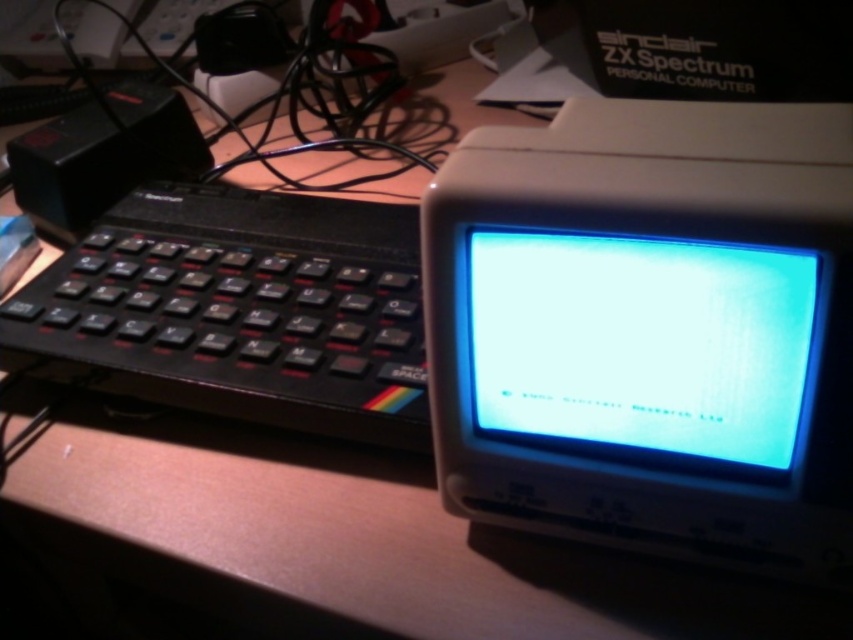
Question: Is black plastic keyboard at left bigger than matte plastic monitor at center?

Choices:
 (A) no
 (B) yes

Answer: (B)

Question: Which of the following is the closest to the observer?

Choices:
 (A) black plastic keyboard at left
 (B) matte plastic monitor at center

Answer: (B)

Question: Is black plastic keyboard at left positioned behind matte plastic monitor at center?

Choices:
 (A) yes
 (B) no

Answer: (A)

Question: Estimate the real-world distances between objects in this image. Which object is farther from the black plastic keyboard at left?

Choices:
 (A) white plastic monitor at center
 (B) matte plastic monitor at center

Answer: (B)

Question: Does black plastic keyboard at left appear over matte plastic monitor at center?

Choices:
 (A) yes
 (B) no

Answer: (A)

Question: Which point appears closest to the camera in this image?

Choices:
 (A) (439, 477)
 (B) (323, 278)
 (C) (686, 378)

Answer: (C)